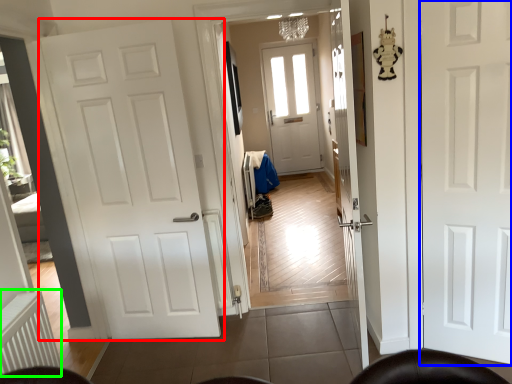
Question: Which object is positioned farthest from door (highlighted by a red box)? Select from door (highlighted by a blue box) and radiator (highlighted by a green box).

Choices:
 (A) door
 (B) radiator

Answer: (A)